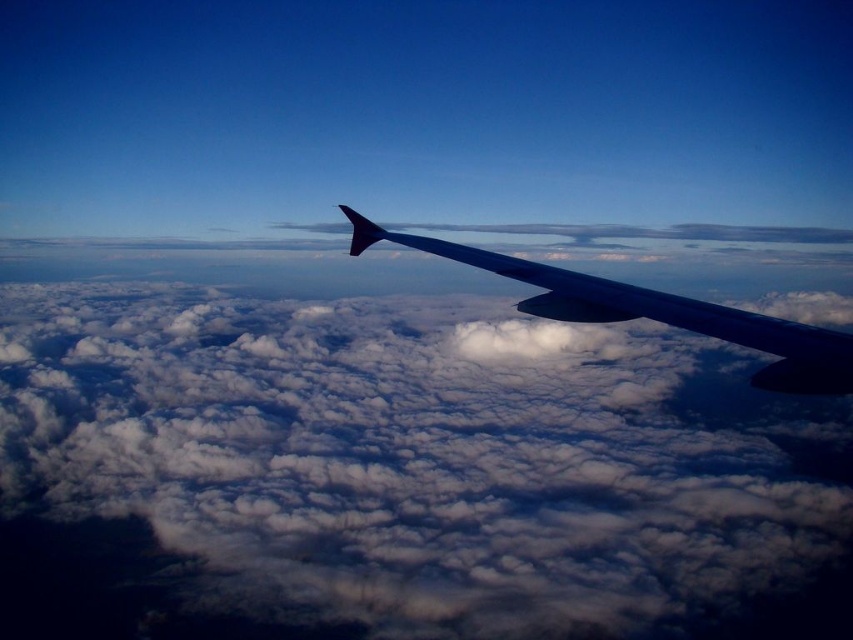
Question: Does white fluffy cloud at upper center have a smaller size compared to metallic gray wing at center?

Choices:
 (A) no
 (B) yes

Answer: (A)

Question: Is white fluffy cloud at upper center positioned before metallic gray wing at center?

Choices:
 (A) yes
 (B) no

Answer: (B)

Question: Which of the following is the closest to the observer?

Choices:
 (A) (483, 257)
 (B) (6, 291)

Answer: (A)

Question: Does white fluffy cloud at upper center appear on the left side of metallic gray wing at center?

Choices:
 (A) yes
 (B) no

Answer: (A)